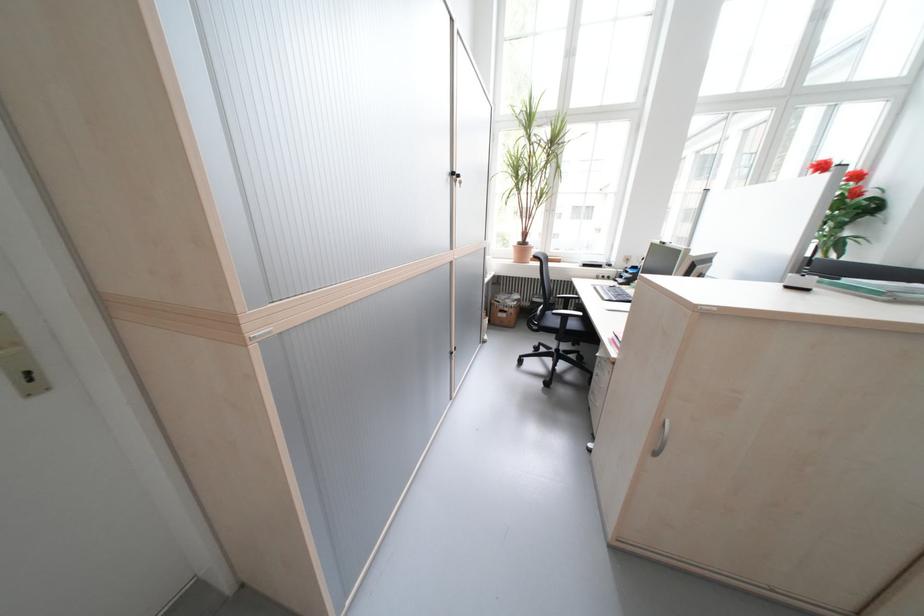
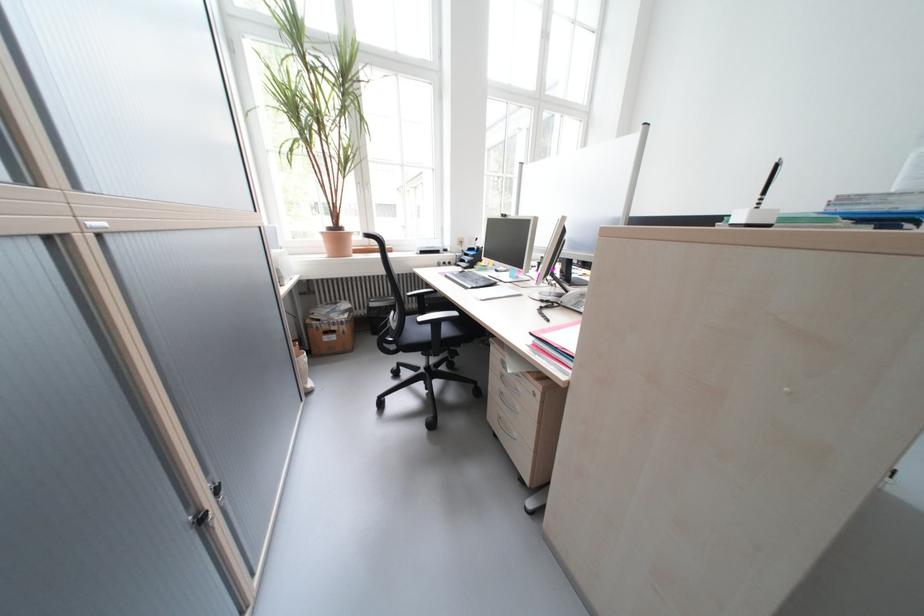
Where in the second image is the point corresponding to the point at 565,313 from the first image?

(431, 320)